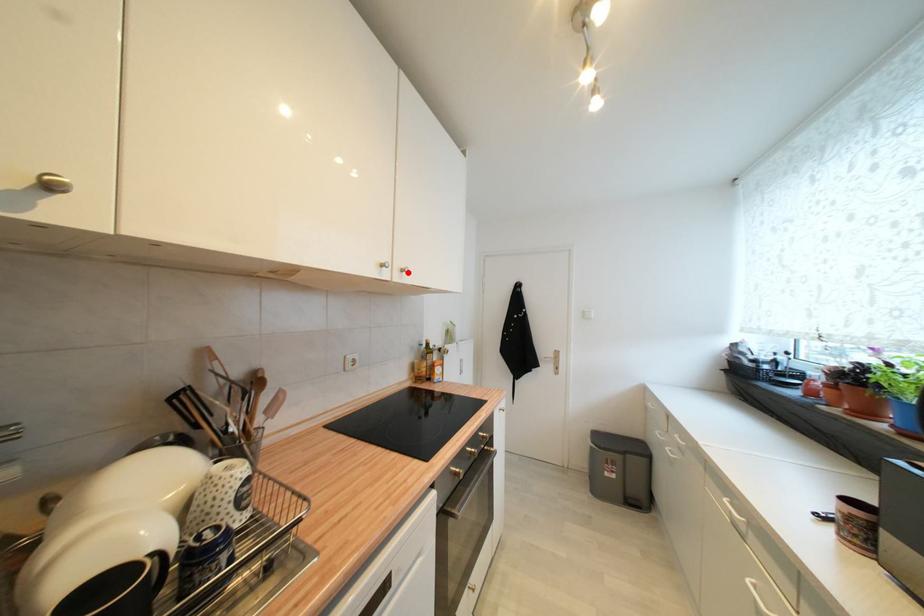
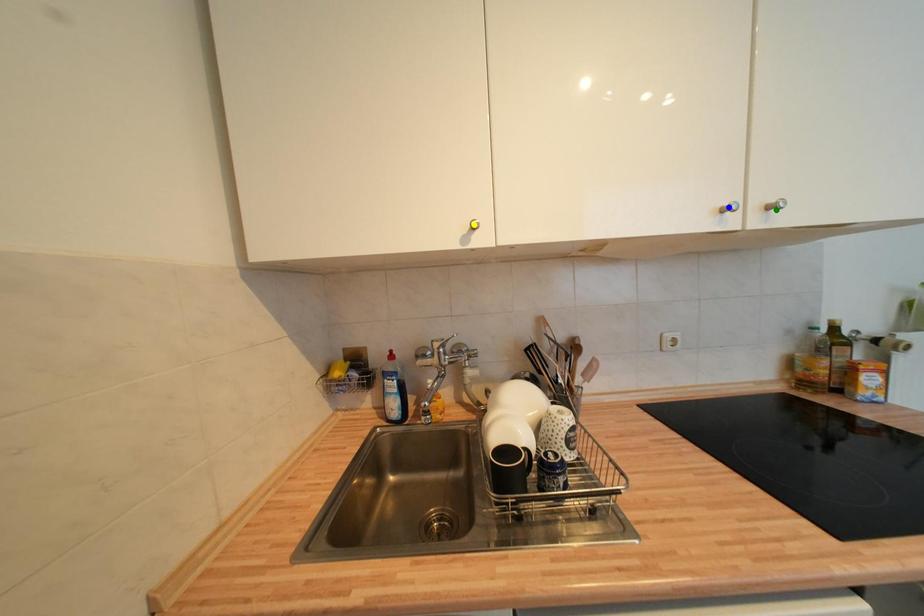
Question: I am providing you with two images of the same scene from different viewpoints. A red point is marked on the first image. You are given multiple points on the second image. Can you choose the point in image 2 that corresponds to the point in image 1?

Choices:
 (A) yellow point
 (B) green point
 (C) blue point

Answer: (B)